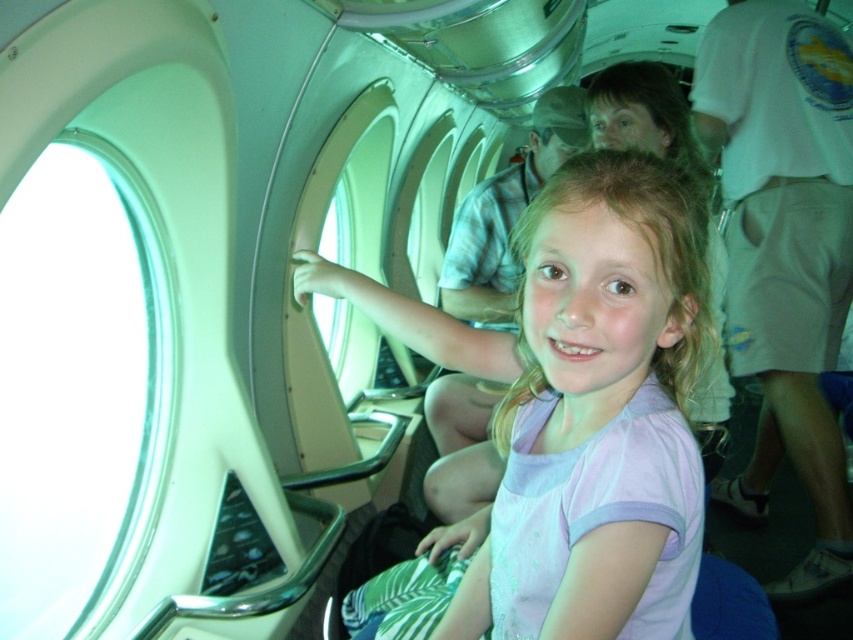
Does transparent glass airplane window at left lie behind pink fabric shirt at center?

That is True.

In the scene shown: Who is positioned more to the left, transparent glass airplane window at left or pink fabric shirt at center?

Positioned to the left is transparent glass airplane window at left.

Who is more forward, (109, 577) or (511, 417)?

Point (511, 417)

The width and height of the screenshot is (853, 640). What are the coordinates of `transparent glass airplane window at left` in the screenshot? It's located at (x=79, y=392).